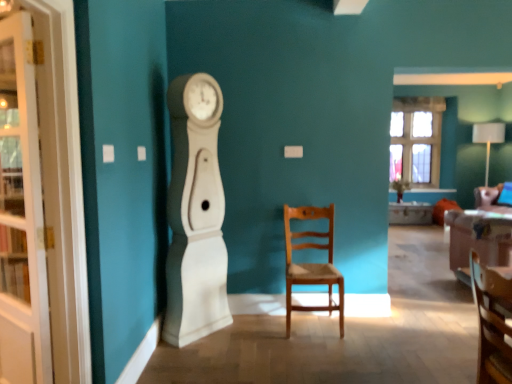
Question: From a real-world perspective, is clear glass window at upper right physically located above or below velvet pink couch at right?

Choices:
 (A) below
 (B) above

Answer: (B)

Question: From the image's perspective, is clear glass window at upper right located above or below velvet pink couch at right?

Choices:
 (A) above
 (B) below

Answer: (A)

Question: Which object is positioned closest to the white glossy desk at center?

Choices:
 (A) white matte clock at left
 (B) white glass cabinet at left
 (C) velvet pink couch at right
 (D) clear glass window at upper right
 (E) wooden chair at center, which is the second chair from right to left

Answer: (D)

Question: Considering the real-world distances, which object is closest to the wooden chair at center, which is the second chair from right to left?

Choices:
 (A) white matte clock at left
 (B) clear glass window at upper right
 (C) white glossy desk at center
 (D) velvet pink couch at right
 (E) white glass cabinet at left

Answer: (A)